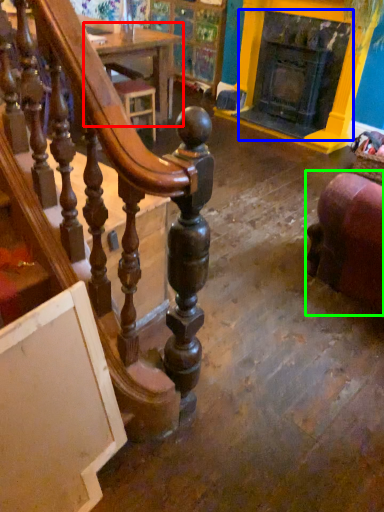
Question: Considering the real-world distances, which object is farthest from table (highlighted by a red box)? fireplace (highlighted by a blue box) or furniture (highlighted by a green box)?

Choices:
 (A) fireplace
 (B) furniture

Answer: (B)